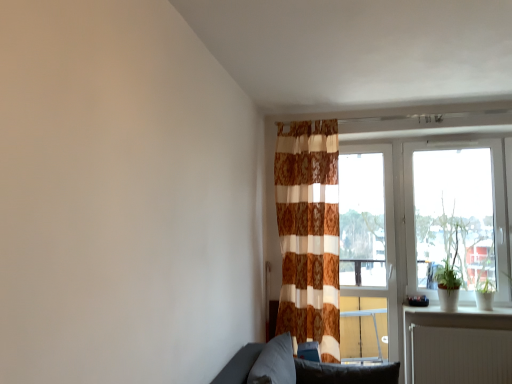
Question: Should I look upward or downward to see soft gray cushion at lower center, which ranks as the second pillow in left-to-right order?

Choices:
 (A) up
 (B) down

Answer: (B)

Question: Does green matte plant at right have a larger size compared to brown textured curtain at center?

Choices:
 (A) yes
 (B) no

Answer: (B)

Question: From the image's perspective, does green matte plant at right appear lower than brown textured curtain at center?

Choices:
 (A) no
 (B) yes

Answer: (B)

Question: Would you say green matte plant at right is outside brown textured curtain at center?

Choices:
 (A) no
 (B) yes

Answer: (B)

Question: Can you confirm if green matte plant at right is positioned to the left of brown textured curtain at center?

Choices:
 (A) yes
 (B) no

Answer: (B)

Question: Does green matte plant at right have a greater height compared to brown textured curtain at center?

Choices:
 (A) no
 (B) yes

Answer: (A)

Question: Considering the relative sizes of green matte plant at right and brown textured curtain at center in the image provided, is green matte plant at right thinner than brown textured curtain at center?

Choices:
 (A) yes
 (B) no

Answer: (A)

Question: From the image's perspective, does transparent glass window at right appear higher than brown textured curtain at center?

Choices:
 (A) yes
 (B) no

Answer: (A)

Question: Is transparent glass window at right shorter than brown textured curtain at center?

Choices:
 (A) no
 (B) yes

Answer: (B)

Question: Can you confirm if transparent glass window at right is positioned to the left of brown textured curtain at center?

Choices:
 (A) yes
 (B) no

Answer: (B)

Question: Could brown textured curtain at center be considered to be inside transparent glass window at right?

Choices:
 (A) no
 (B) yes

Answer: (A)

Question: Is brown textured curtain at center at the back of transparent glass window at right?

Choices:
 (A) no
 (B) yes

Answer: (A)

Question: Does transparent glass window at right appear on the right side of brown textured curtain at center?

Choices:
 (A) no
 (B) yes

Answer: (B)

Question: Is dark gray fabric pillow at lower center, the first pillow positioned from the left, oriented away from white glossy window sill at lower right?

Choices:
 (A) yes
 (B) no

Answer: (B)